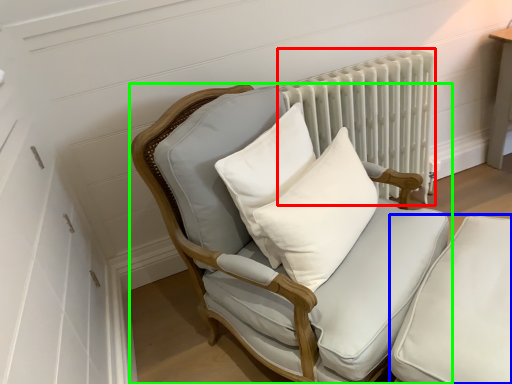
Question: Which object is the farthest from radiator (highlighted by a red box)? Choose among these: swivel chair (highlighted by a blue box) or chair (highlighted by a green box).

Choices:
 (A) swivel chair
 (B) chair

Answer: (A)